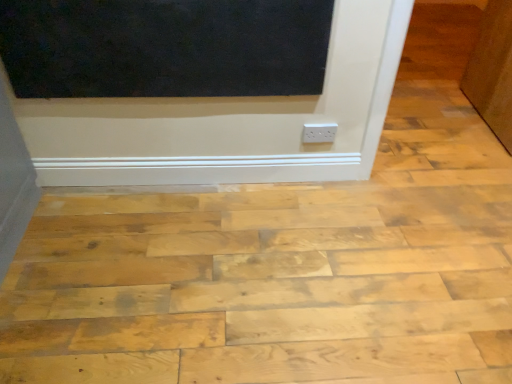
Question: Considering the relative sizes of matte black screen door at upper center and white plastic outlet at center in the image provided, is matte black screen door at upper center taller than white plastic outlet at center?

Choices:
 (A) no
 (B) yes

Answer: (B)

Question: Is matte black screen door at upper center shorter than white plastic outlet at center?

Choices:
 (A) no
 (B) yes

Answer: (A)

Question: Does matte black screen door at upper center come behind white plastic outlet at center?

Choices:
 (A) no
 (B) yes

Answer: (A)

Question: Is matte black screen door at upper center to the right of white plastic outlet at center from the viewer's perspective?

Choices:
 (A) yes
 (B) no

Answer: (B)

Question: Is matte black screen door at upper center placed right next to white plastic outlet at center?

Choices:
 (A) no
 (B) yes

Answer: (A)

Question: Can you confirm if matte black screen door at upper center is smaller than white plastic outlet at center?

Choices:
 (A) no
 (B) yes

Answer: (A)

Question: Does brown matte door at upper right have a lesser height compared to matte black screen door at upper center?

Choices:
 (A) no
 (B) yes

Answer: (A)

Question: Considering the relative positions of brown matte door at upper right and matte black screen door at upper center in the image provided, is brown matte door at upper right behind matte black screen door at upper center?

Choices:
 (A) no
 (B) yes

Answer: (B)

Question: Is brown matte door at upper right outside of matte black screen door at upper center?

Choices:
 (A) yes
 (B) no

Answer: (A)

Question: Is brown matte door at upper right at the left side of matte black screen door at upper center?

Choices:
 (A) no
 (B) yes

Answer: (A)

Question: Could you tell me if brown matte door at upper right is turned towards matte black screen door at upper center?

Choices:
 (A) no
 (B) yes

Answer: (A)

Question: Is brown matte door at upper right taller than matte black screen door at upper center?

Choices:
 (A) no
 (B) yes

Answer: (B)

Question: Considering the relative positions of brown matte door at upper right and natural wood plywood at center in the image provided, is brown matte door at upper right behind natural wood plywood at center?

Choices:
 (A) yes
 (B) no

Answer: (A)